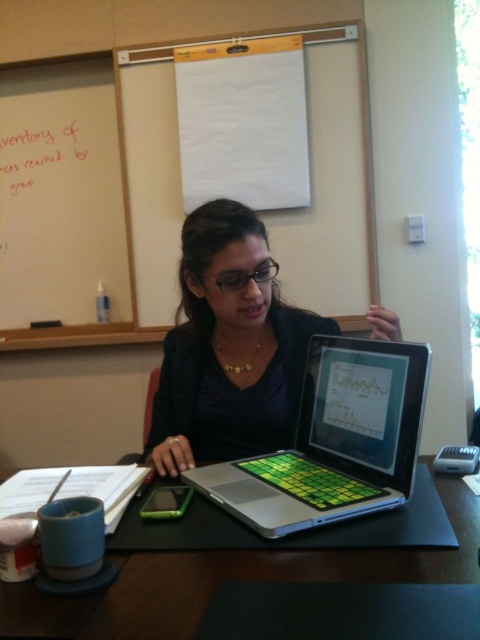
Is black matte table at lower center positioned at the back of whiteboard at upper left?

No, it is not.

At what (x,y) coordinates should I click in order to perform the action: click on black matte table at lower center. Please return your answer as a coordinate pair (x, y). The height and width of the screenshot is (640, 480). Looking at the image, I should click on (232, 579).

Locate an element on the screen. The image size is (480, 640). black matte table at lower center is located at coordinates (232, 579).

Between matte black laptop at center and green matte laptop at center, which one appears on the left side from the viewer's perspective?

From the viewer's perspective, matte black laptop at center appears more on the left side.

Is matte black laptop at center positioned before green matte laptop at center?

That is False.

Is point (244, 220) less distant than point (228, 497)?

No, it is behind (228, 497).

The image size is (480, 640). I want to click on matte black laptop at center, so click(x=228, y=348).

Which of these two, matte black laptop at center or whiteboard at upper left, stands taller?

whiteboard at upper left is taller.

Does matte black laptop at center have a larger size compared to whiteboard at upper left?

No, matte black laptop at center is not bigger than whiteboard at upper left.

Is point (395, 332) closer to camera compared to point (111, 49)?

Yes, point (395, 332) is in front of point (111, 49).

Where is `matte black laptop at center`? This screenshot has width=480, height=640. matte black laptop at center is located at coordinates (228, 348).